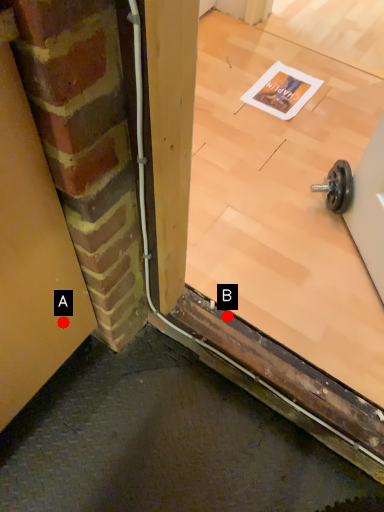
Question: Two points are circled on the image, labeled by A and B beside each circle. Among these points, which one is nearest to the camera?

Choices:
 (A) A is closer
 (B) B is closer

Answer: (A)